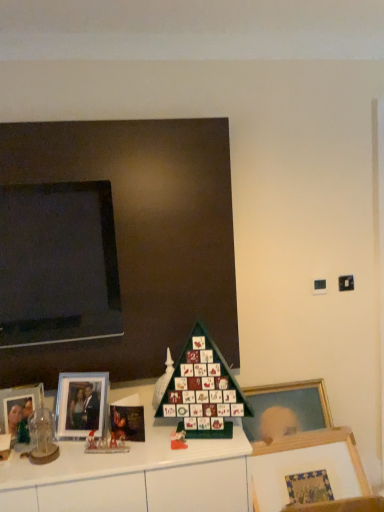
This screenshot has height=512, width=384. I want to click on vacant area located to the right-hand side of matte glass picture frame at left, positioned as the first picture frame in left-to-right order, so click(x=58, y=447).